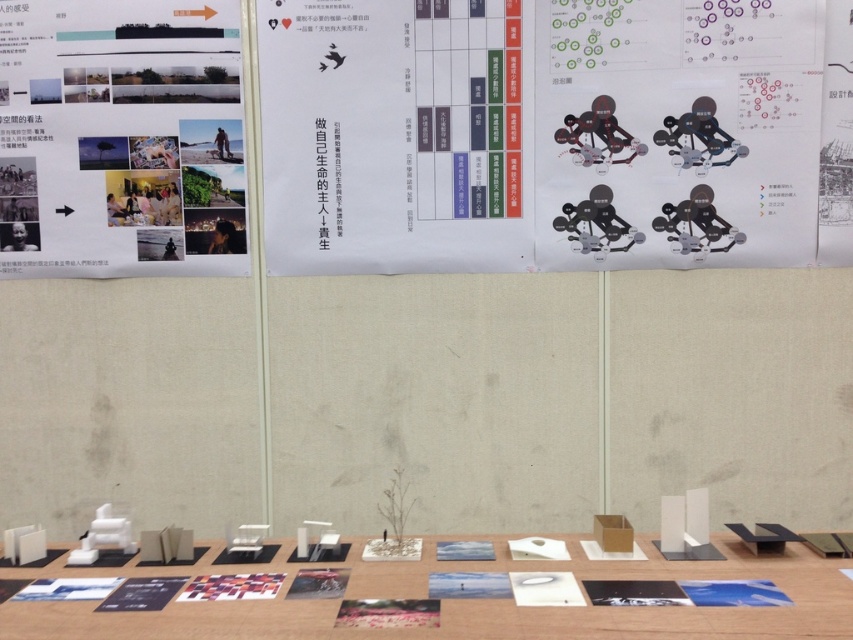
You are an event organizer who needs to place a 1.5 meter wide decorative banner between the matte paper collage at upper left and the white matte table at center. Is there enough space for it?

The matte paper collage at upper left is positioned on the left side of white matte table at center. Since the banner is 1.5 meters wide, but the exact distance between the two objects isn not provided, it is unclear if there is sufficient space. More information about the distance between them is needed to determine this.

You are a visitor standing in front of the display setup. You want to locate the matte black poster at upper center. According to the coordinates provided, where should you look relative to the center of the image?

The matte black poster at upper center is located at coordinates point (x=554, y=132), which means it is positioned slightly to the left and above the center of the image.

You are an event organizer setting up a new display. You have a matte black poster at upper center and a matte paper collage at upper left. Based on the scene description, which object is wider?

The matte black poster at upper center might be wider than matte paper collage at upper left according to the description.